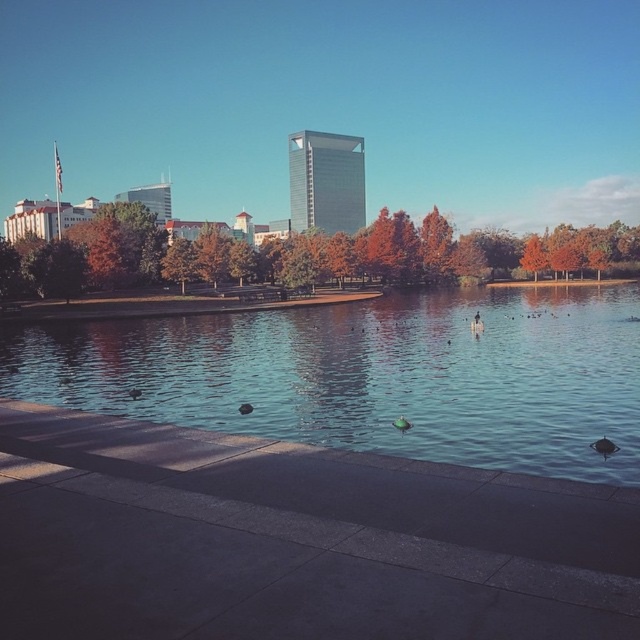
Is the position of orange matte tree at upper center more distant than that of orange matte tree at center?

No.

Is orange matte tree at upper center below orange matte tree at center?

Incorrect, orange matte tree at upper center is not positioned below orange matte tree at center.

Who is more forward, (x=604, y=253) or (x=540, y=266)?

Point (x=604, y=253) is in front.

This screenshot has height=640, width=640. What are the coordinates of `orange matte tree at upper center` in the screenshot? It's located at (248, 253).

The width and height of the screenshot is (640, 640). What do you see at coordinates (476, 324) in the screenshot?
I see `brown fuzzy duck at center` at bounding box center [476, 324].

Looking at this image, between brown fuzzy duck at center and green matte duck at center, which one appears on the right side from the viewer's perspective?

Positioned to the right is brown fuzzy duck at center.

Does point (477, 310) come in front of point (400, 417)?

That is False.

This screenshot has height=640, width=640. I want to click on brown fuzzy duck at center, so click(476, 324).

Is orange matte tree at upper center behind brown fuzzy duck at center?

Yes, orange matte tree at upper center is behind brown fuzzy duck at center.

Does orange matte tree at upper center have a larger size compared to brown fuzzy duck at center?

Yes.

Identify the location of orange matte tree at upper center. This screenshot has width=640, height=640. pyautogui.click(x=248, y=253).